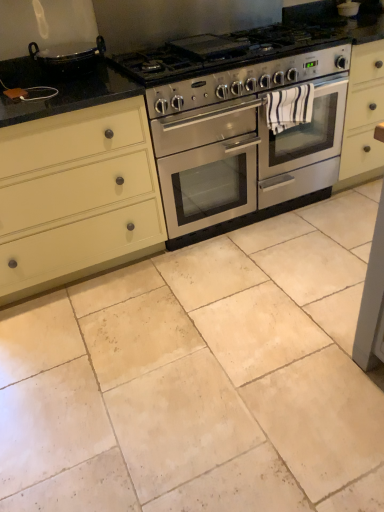
Question: From the image's perspective, is white striped towel at center over matte cream cabinet at left?

Choices:
 (A) no
 (B) yes

Answer: (B)

Question: Does white striped towel at center turn towards matte cream cabinet at left?

Choices:
 (A) no
 (B) yes

Answer: (A)

Question: Is white striped towel at center closer to camera compared to matte cream cabinet at left?

Choices:
 (A) yes
 (B) no

Answer: (B)

Question: From the image's perspective, does white striped towel at center appear lower than matte cream cabinet at left?

Choices:
 (A) no
 (B) yes

Answer: (A)

Question: From a real-world perspective, is white striped towel at center over matte cream cabinet at left?

Choices:
 (A) yes
 (B) no

Answer: (A)

Question: Based on their sizes in the image, would you say stainless steel oven at center is bigger or smaller than beige stone tile at center?

Choices:
 (A) small
 (B) big

Answer: (B)

Question: From a real-world perspective, is stainless steel oven at center positioned above or below beige stone tile at center?

Choices:
 (A) below
 (B) above

Answer: (B)

Question: Considering the relative positions of stainless steel oven at center and beige stone tile at center in the image provided, is stainless steel oven at center to the left or to the right of beige stone tile at center?

Choices:
 (A) left
 (B) right

Answer: (A)

Question: From their relative heights in the image, would you say stainless steel oven at center is taller or shorter than beige stone tile at center?

Choices:
 (A) short
 (B) tall

Answer: (B)

Question: Looking at their shapes, would you say matte cream cabinet at left is wider or thinner than white striped towel at center?

Choices:
 (A) wide
 (B) thin

Answer: (A)

Question: Is matte cream cabinet at left situated inside white striped towel at center or outside?

Choices:
 (A) outside
 (B) inside

Answer: (A)

Question: From the image's perspective, is matte cream cabinet at left above or below white striped towel at center?

Choices:
 (A) below
 (B) above

Answer: (A)

Question: Considering the positions of matte cream cabinet at left and white striped towel at center in the image, is matte cream cabinet at left taller or shorter than white striped towel at center?

Choices:
 (A) short
 (B) tall

Answer: (B)

Question: Considering the positions of beige stone tile at center and black granite countertop at center in the image, is beige stone tile at center bigger or smaller than black granite countertop at center?

Choices:
 (A) small
 (B) big

Answer: (B)

Question: In the image, is beige stone tile at center positioned in front of or behind black granite countertop at center?

Choices:
 (A) front
 (B) behind

Answer: (A)